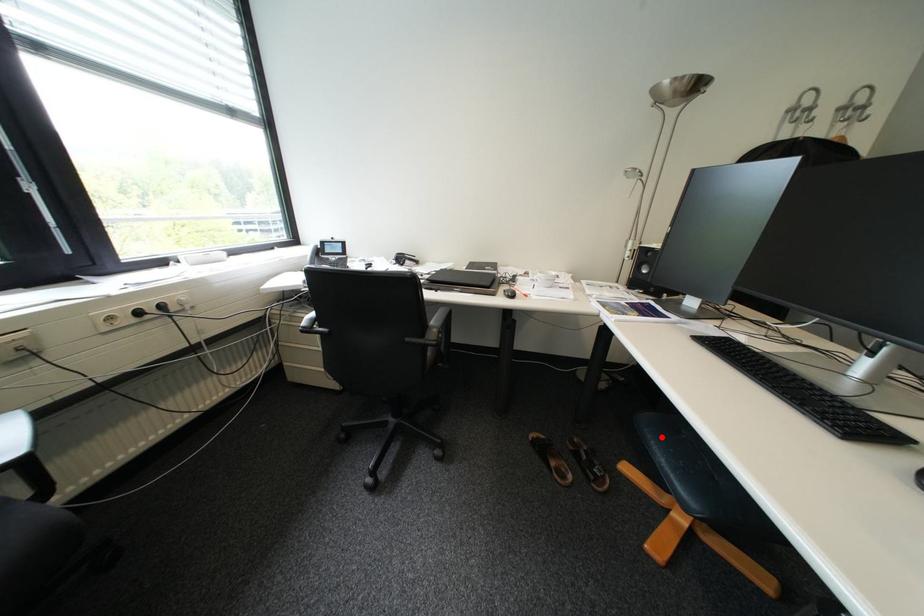
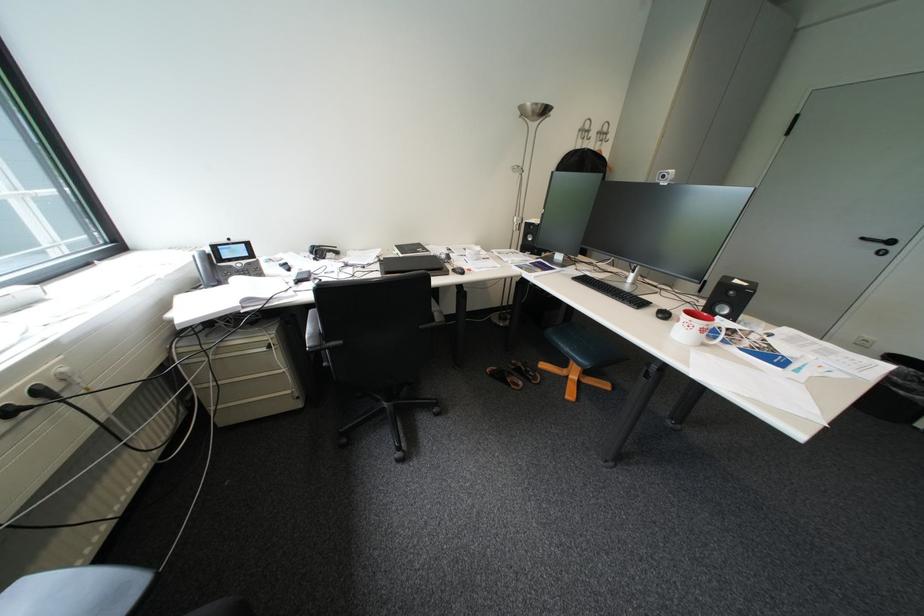
In the second image, find the point that corresponds to the highlighted location in the first image.

(569, 341)